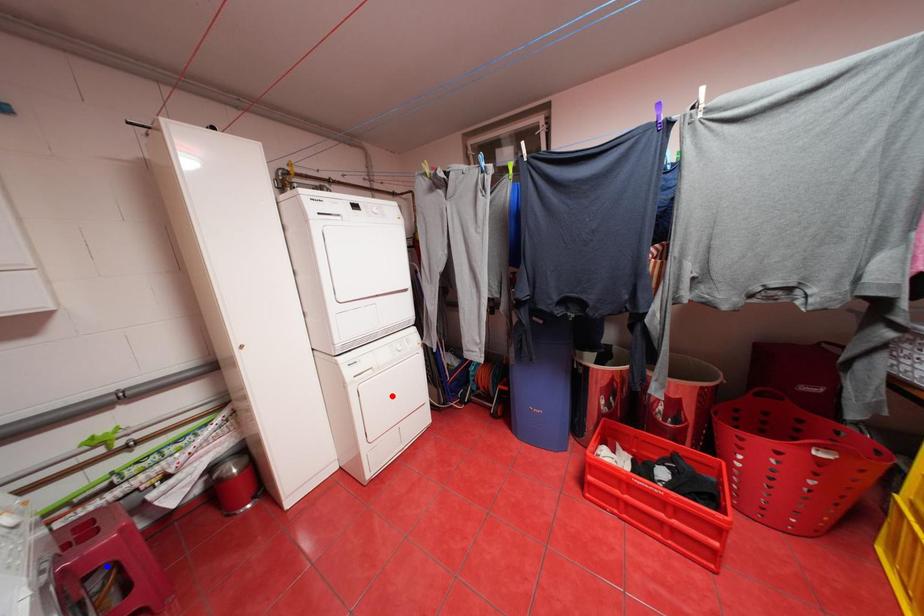
Question: In the image, two points are highlighted. Which point is nearer to the camera? Reply with the corresponding letter.

Choices:
 (A) blue point
 (B) red point

Answer: (A)